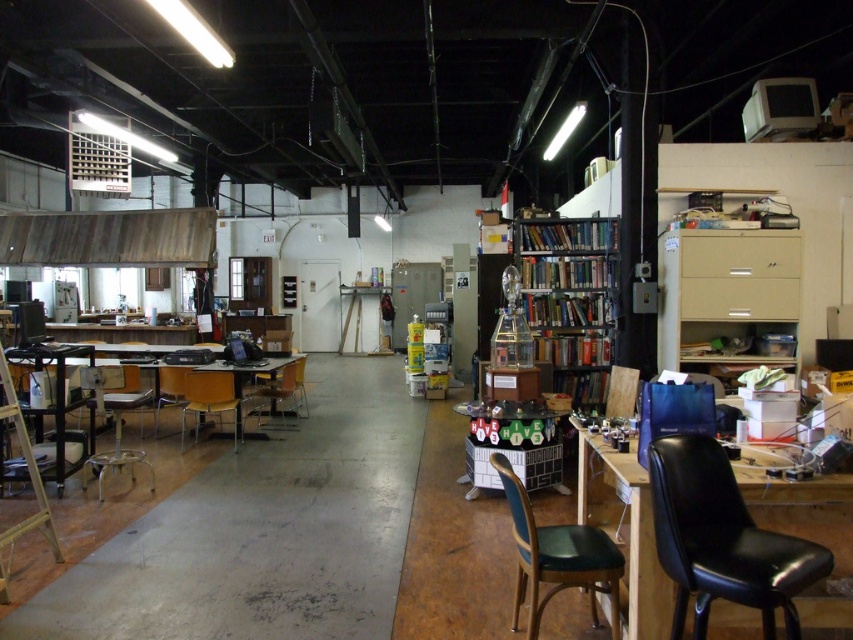
Does wooden ladder at left come in front of wooden chair at center?

Yes, it is in front of wooden chair at center.

Identify the location of wooden ladder at left. (27, 470).

Does point (21, 422) come farther from viewer compared to point (236, 403)?

That is False.

Locate an element on the screen. wooden ladder at left is located at coordinates (27, 470).

Measure the distance from black leather swivel chair at right to green leather swivel chair at lower center.

black leather swivel chair at right is 22.62 inches away from green leather swivel chair at lower center.

Where is `black leather swivel chair at right`? The height and width of the screenshot is (640, 853). black leather swivel chair at right is located at coordinates (722, 540).

The width and height of the screenshot is (853, 640). I want to click on black leather swivel chair at right, so click(722, 540).

Between black leather swivel chair at right and wooden chair at left, which one appears on the right side from the viewer's perspective?

black leather swivel chair at right is more to the right.

Does black leather swivel chair at right have a lesser height compared to wooden chair at left?

Incorrect, black leather swivel chair at right's height does not fall short of wooden chair at left's.

Does point (712, 470) lie in front of point (265, 397)?

Yes, it is.

The image size is (853, 640). Identify the location of black leather swivel chair at right. (722, 540).